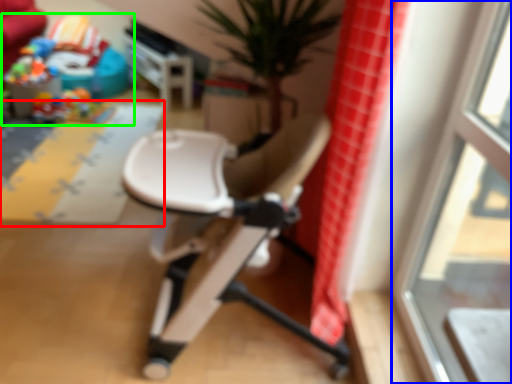
Question: Estimate the real-world distances between objects in this image. Which object is farther from plain (highlighted by a red box), window (highlighted by a blue box) or toy (highlighted by a green box)?

Choices:
 (A) window
 (B) toy

Answer: (A)